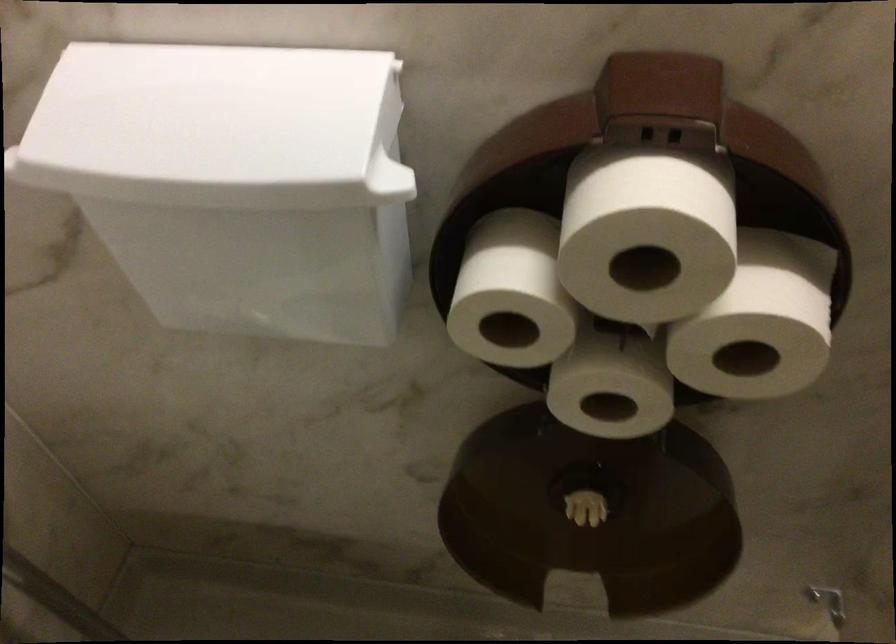
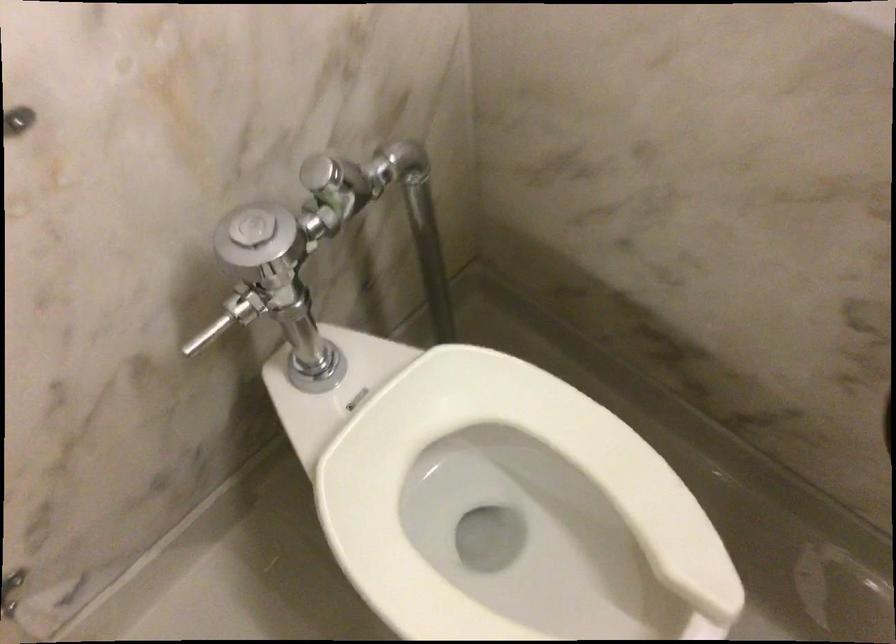
Question: The camera is either moving clockwise (left) or counter-clockwise (right) around the object. The first image is from the beginning of the video and the second image is from the end. Is the camera moving left or right when shooting the video?

Choices:
 (A) Left
 (B) Right

Answer: (B)